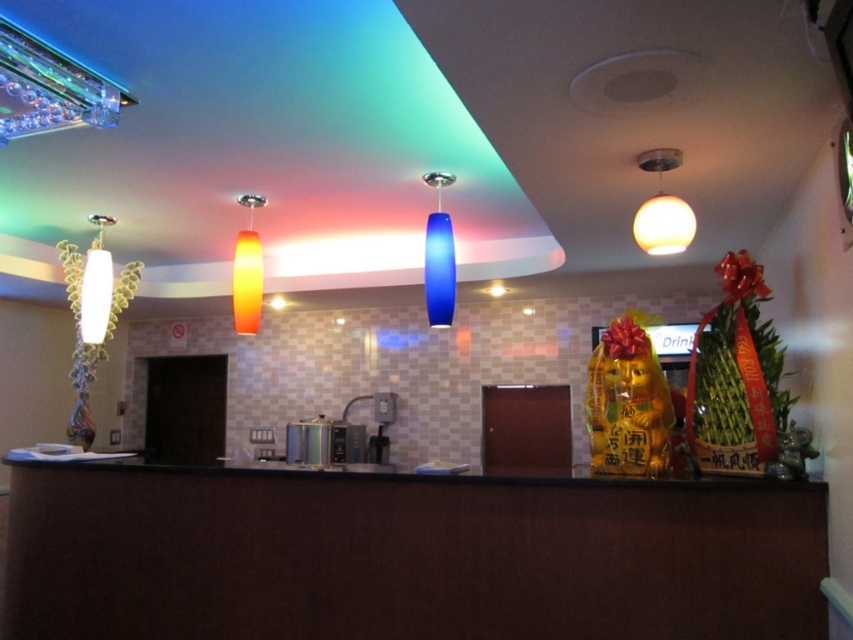
Question: Is white glossy sphere at upper right below white glossy lamp at left?

Choices:
 (A) yes
 (B) no

Answer: (B)

Question: Which point is closer to the camera?

Choices:
 (A) (662, 147)
 (B) (83, 333)
 (C) (244, 234)
 (D) (434, 301)

Answer: (A)

Question: Observing the image, what is the correct spatial positioning of white glossy sphere at upper right in reference to orange matte lamp at center?

Choices:
 (A) above
 (B) below

Answer: (A)

Question: Which object is closer to the camera taking this photo?

Choices:
 (A) orange matte lamp at center
 (B) white glossy sphere at upper right
 (C) white glossy lamp at left
 (D) blue glass pendant at center

Answer: (B)

Question: Is blue glass pendant at center positioned before orange matte lamp at center?

Choices:
 (A) no
 (B) yes

Answer: (B)

Question: Among these objects, which one is nearest to the camera?

Choices:
 (A) orange matte lamp at center
 (B) white glossy lamp at left
 (C) white glossy sphere at upper right
 (D) blue glass pendant at center

Answer: (C)